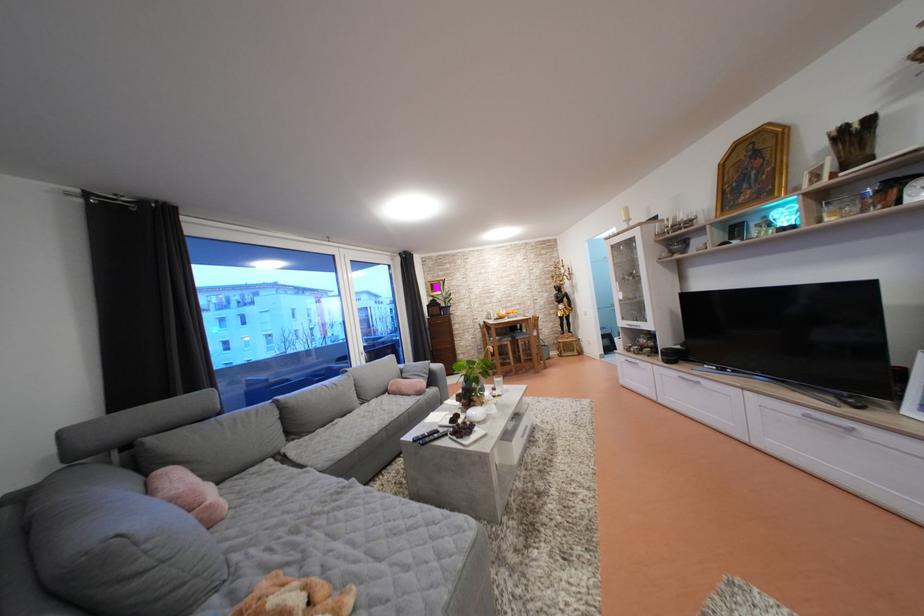
The image size is (924, 616). Find the location of `glass plant vase`. glass plant vase is located at coordinates (472, 379).